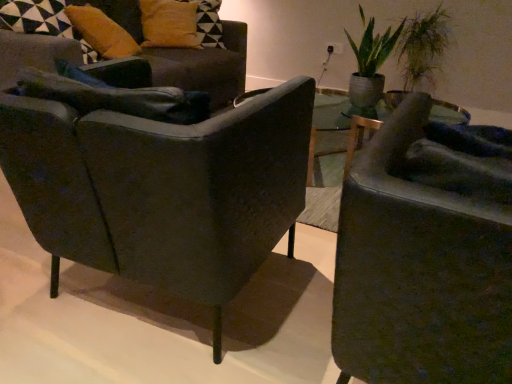
Question: Can you confirm if matte black armchair at right, arranged as the 3th chair when viewed from the back, is wider than mustard yellow fabric pillow at upper left, arranged as the 2th pillow when viewed from the back?

Choices:
 (A) no
 (B) yes

Answer: (B)

Question: From a real-world perspective, is matte black armchair at right, the first chair positioned from the front, located beneath mustard yellow fabric pillow at upper left, which appears as the 1th pillow when viewed from the front?

Choices:
 (A) yes
 (B) no

Answer: (A)

Question: Is matte black armchair at right, the first chair positioned from the front, to the left of mustard yellow fabric pillow at upper left, arranged as the 2th pillow when viewed from the back, from the viewer's perspective?

Choices:
 (A) yes
 (B) no

Answer: (B)

Question: Does matte black armchair at right, the first chair positioned from the front, have a lesser height compared to mustard yellow fabric pillow at upper left, arranged as the 2th pillow when viewed from the back?

Choices:
 (A) yes
 (B) no

Answer: (B)

Question: Is matte black armchair at right, the first chair positioned from the front, completely or partially outside of mustard yellow fabric pillow at upper left, arranged as the 2th pillow when viewed from the back?

Choices:
 (A) yes
 (B) no

Answer: (A)

Question: Considering the relative sizes of matte black armchair at right, arranged as the 3th chair when viewed from the back, and mustard yellow fabric pillow at upper left, which appears as the 1th pillow when viewed from the front, in the image provided, is matte black armchair at right, arranged as the 3th chair when viewed from the back, taller than mustard yellow fabric pillow at upper left, which appears as the 1th pillow when viewed from the front,?

Choices:
 (A) no
 (B) yes

Answer: (B)

Question: Does green leafy plant at upper right have a larger size compared to green leafy plant at upper right?

Choices:
 (A) yes
 (B) no

Answer: (B)

Question: Is green leafy plant at upper right to the left of green leafy plant at upper right from the viewer's perspective?

Choices:
 (A) yes
 (B) no

Answer: (A)

Question: Is the position of green leafy plant at upper right less distant than that of green leafy plant at upper right?

Choices:
 (A) no
 (B) yes

Answer: (B)

Question: Does green leafy plant at upper right have a smaller size compared to green leafy plant at upper right?

Choices:
 (A) yes
 (B) no

Answer: (A)

Question: From the image's perspective, is green leafy plant at upper right under green leafy plant at upper right?

Choices:
 (A) no
 (B) yes

Answer: (B)

Question: Is green leafy plant at upper right at the right side of green leafy plant at upper right?

Choices:
 (A) yes
 (B) no

Answer: (B)

Question: Is matte black armchair at left, arranged as the 3th chair when viewed from the front, smaller than green leafy plant at upper right?

Choices:
 (A) no
 (B) yes

Answer: (A)